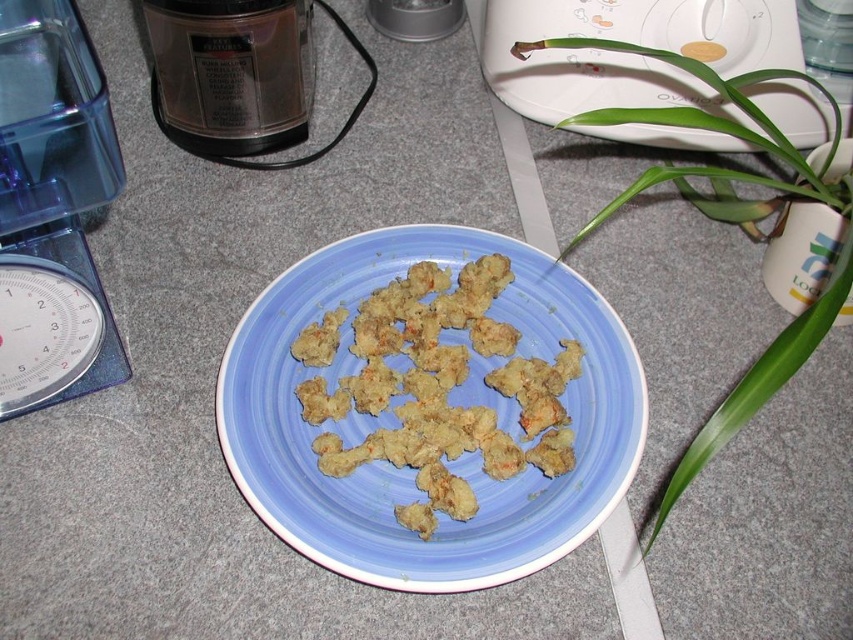
Question: Which of the following is the closest to the observer?

Choices:
 (A) (317, 353)
 (B) (405, 6)
 (C) (111, 362)

Answer: (C)

Question: Which is nearer to the green leafy plant at upper right?

Choices:
 (A) golden crispy nuggets at center
 (B) white plastic toaster at upper center
 (C) metallic silver toaster at upper center

Answer: (B)

Question: Which point appears closest to the camera in this image?

Choices:
 (A) (769, 236)
 (B) (49, 48)
 (C) (346, 131)

Answer: (B)

Question: Does white plastic toaster at upper center appear on the right side of metallic silver toaster at upper center?

Choices:
 (A) no
 (B) yes

Answer: (B)

Question: Can you confirm if golden crispy nuggets at center is thinner than metallic silver toaster at upper center?

Choices:
 (A) yes
 (B) no

Answer: (B)

Question: Is white plastic toaster at upper center below black plastic blender at upper left?

Choices:
 (A) no
 (B) yes

Answer: (A)